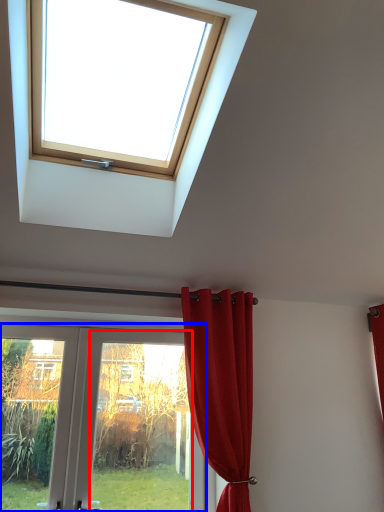
Question: Which object is closer to the camera taking this photo, glass door (highlighted by a red box) or door (highlighted by a blue box)?

Choices:
 (A) glass door
 (B) door

Answer: (B)